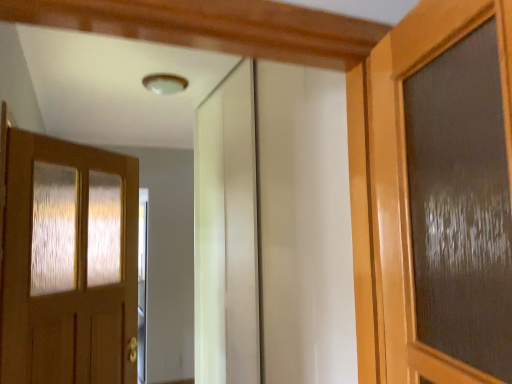
Question: From their relative heights in the image, would you say white glossy elevator at center is taller or shorter than matte wood door at left?

Choices:
 (A) short
 (B) tall

Answer: (B)

Question: Relative to matte wood door at left, is white glossy elevator at center in front or behind?

Choices:
 (A) front
 (B) behind

Answer: (A)

Question: From the image's perspective, relative to matte wood door at left, is white glossy elevator at center above or below?

Choices:
 (A) below
 (B) above

Answer: (B)

Question: Is point (44, 301) closer or farther from the camera than point (323, 314)?

Choices:
 (A) closer
 (B) farther

Answer: (B)

Question: Considering their positions, is matte wood door at left located in front of or behind white glossy elevator at center?

Choices:
 (A) behind
 (B) front

Answer: (A)

Question: Is matte wood door at left inside the boundaries of white glossy elevator at center, or outside?

Choices:
 (A) outside
 (B) inside

Answer: (A)

Question: Is matte wood door at left taller or shorter than white glossy elevator at center?

Choices:
 (A) short
 (B) tall

Answer: (A)